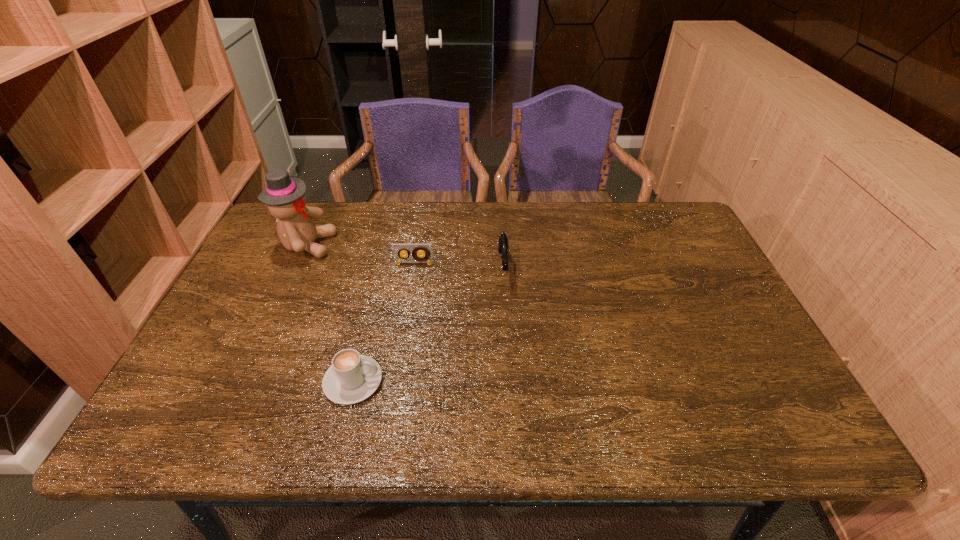
Identify the location of vacant space that satisfies the following two spatial constraints: 1. at the end of the barrel of the gun; 2. to the right of the cappuccino. The image size is (960, 540). (510, 381).

Where is `vacant area that satisfies the following two spatial constraints: 1. at the end of the barrel of the gun; 2. to the right of the cappuccino`? vacant area that satisfies the following two spatial constraints: 1. at the end of the barrel of the gun; 2. to the right of the cappuccino is located at coordinates pyautogui.click(x=510, y=381).

The height and width of the screenshot is (540, 960). What are the coordinates of `free space in the image that satisfies the following two spatial constraints: 1. at the end of the barrel of the gun; 2. to the right of the cappuccino` in the screenshot? It's located at (510, 381).